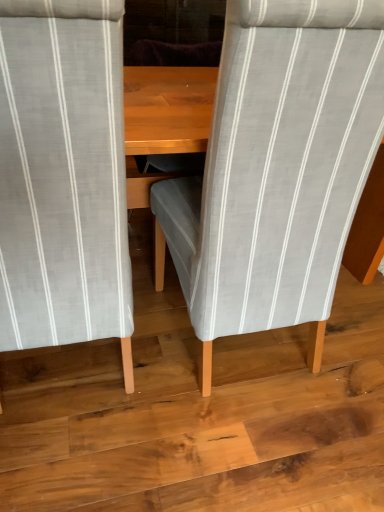
This screenshot has height=512, width=384. In order to click on free space between light gray striped fabric chair at center, the second chair when ordered from right to left, and light gray striped fabric chair at center, placed as the 2th chair when sorted from left to right in this screenshot , I will do `click(139, 352)`.